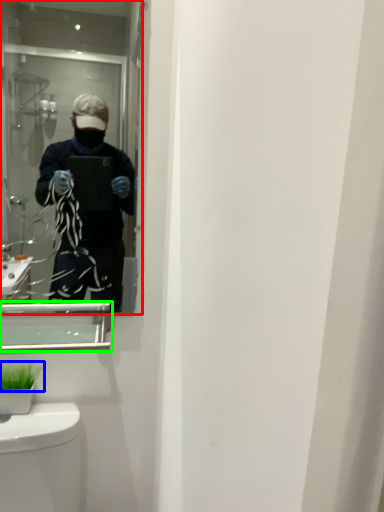
Question: Which object is positioned closest to mirror (highlighted by a red box)? Select from plant (highlighted by a blue box) and medicine cabinet (highlighted by a green box).

Choices:
 (A) plant
 (B) medicine cabinet

Answer: (B)